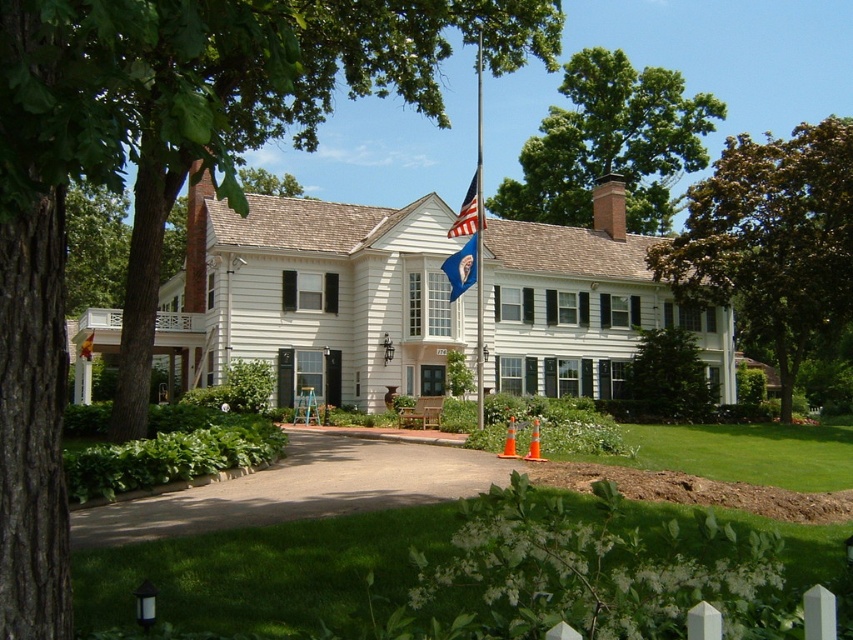
Between brown textured tree at upper right and green leafy tree at center, which one is positioned lower?

green leafy tree at center is lower down.

Is point (700, 220) farther from camera compared to point (643, 396)?

Yes, it is.

This screenshot has width=853, height=640. What are the coordinates of `brown textured tree at upper right` in the screenshot? It's located at (770, 241).

Is white wood house at center in front of smooth asphalt driveway at center?

No, white wood house at center is behind smooth asphalt driveway at center.

Can you confirm if white wood house at center is positioned to the right of smooth asphalt driveway at center?

In fact, white wood house at center is to the left of smooth asphalt driveway at center.

Identify the location of white wood house at center. The image size is (853, 640). (316, 298).

This screenshot has width=853, height=640. What are the coordinates of `white wood house at center` in the screenshot? It's located at (316, 298).

Between blue fabric flag at center and american flag at center, which one appears on the left side from the viewer's perspective?

blue fabric flag at center

Find the location of a particular element. The height and width of the screenshot is (640, 853). blue fabric flag at center is located at coordinates [461, 268].